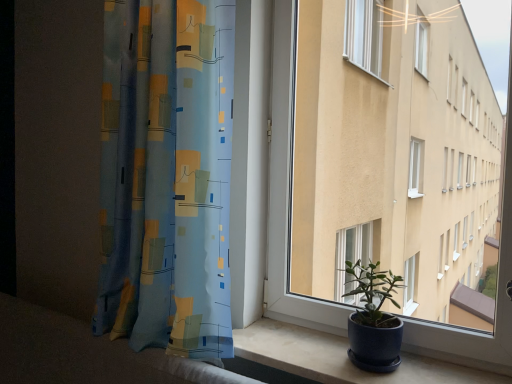
The height and width of the screenshot is (384, 512). I want to click on vacant area situated below matte white window at center (from a real-world perspective), so click(404, 356).